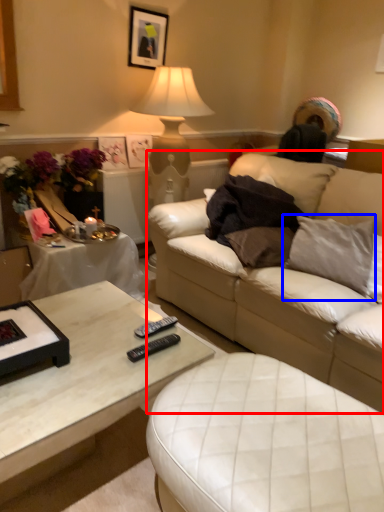
Question: Which of the following is the closest to the observer, studio couch (highlighted by a red box) or pillow (highlighted by a blue box)?

Choices:
 (A) studio couch
 (B) pillow

Answer: (A)